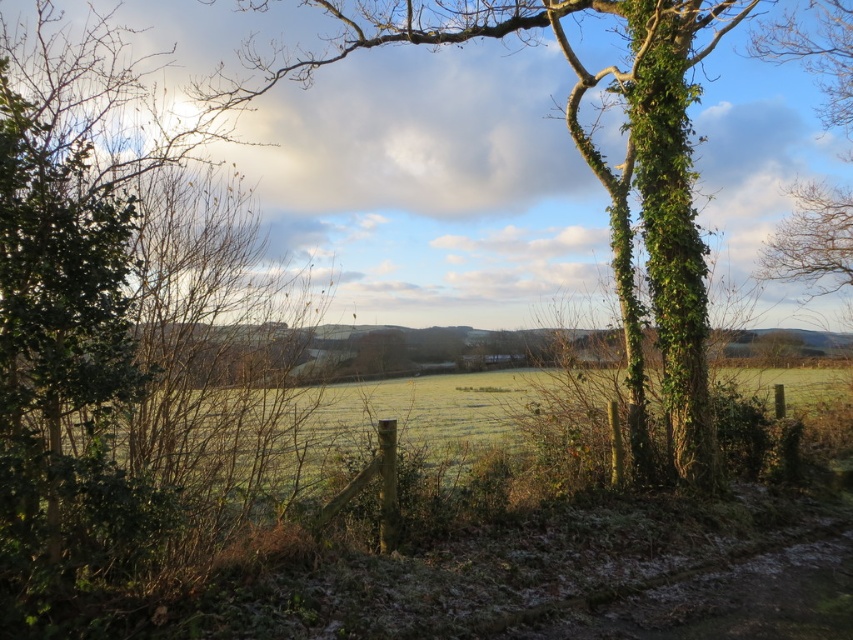
Who is higher up, green leafy tree at left or green ivy-covered tree at center?

green ivy-covered tree at center is higher up.

Describe the element at coordinates (126, 339) in the screenshot. I see `green leafy tree at left` at that location.

Describe the element at coordinates (126, 339) in the screenshot. The image size is (853, 640). I see `green leafy tree at left` at that location.

Where is `green leafy tree at left`? Image resolution: width=853 pixels, height=640 pixels. green leafy tree at left is located at coordinates (126, 339).